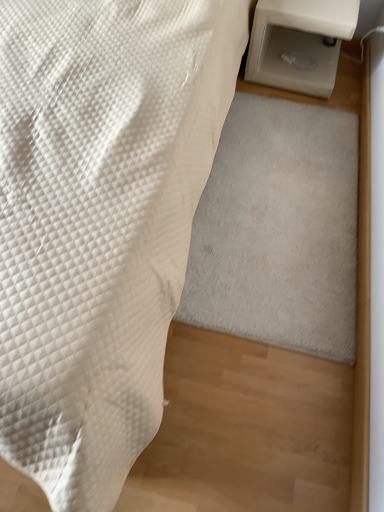
Question: From the image's perspective, would you say white plastic table at right is shown under white quilted fabric at lower left?

Choices:
 (A) yes
 (B) no

Answer: (B)

Question: Is there a large distance between white plastic table at right and white quilted fabric at lower left?

Choices:
 (A) yes
 (B) no

Answer: (B)

Question: Is white quilted fabric at lower left a part of white plastic table at right?

Choices:
 (A) no
 (B) yes

Answer: (A)

Question: Can you confirm if white plastic table at right is wider than white quilted fabric at lower left?

Choices:
 (A) yes
 (B) no

Answer: (B)

Question: Is white plastic table at right positioned with its back to white quilted fabric at lower left?

Choices:
 (A) no
 (B) yes

Answer: (A)

Question: In terms of size, does white soft rug at lower right appear bigger or smaller than white quilted fabric at lower left?

Choices:
 (A) big
 (B) small

Answer: (B)

Question: Considering the positions of point (216, 295) and point (8, 305), is point (216, 295) closer or farther from the camera than point (8, 305)?

Choices:
 (A) closer
 (B) farther

Answer: (B)

Question: Is white soft rug at lower right to the left or to the right of white quilted fabric at lower left in the image?

Choices:
 (A) left
 (B) right

Answer: (B)

Question: Is white soft rug at lower right wider or thinner than white quilted fabric at lower left?

Choices:
 (A) wide
 (B) thin

Answer: (B)

Question: From a real-world perspective, is white plastic table at right physically located above or below white soft rug at lower right?

Choices:
 (A) above
 (B) below

Answer: (A)

Question: From the image's perspective, is white plastic table at right located above or below white soft rug at lower right?

Choices:
 (A) below
 (B) above

Answer: (B)

Question: Does point (306, 38) appear closer or farther from the camera than point (331, 228)?

Choices:
 (A) closer
 (B) farther

Answer: (B)

Question: Based on their positions, is white plastic table at right located to the left or right of white soft rug at lower right?

Choices:
 (A) right
 (B) left

Answer: (A)

Question: From the image's perspective, is white quilted fabric at lower left above or below white plastic table at right?

Choices:
 (A) above
 (B) below

Answer: (B)

Question: Relative to white plastic table at right, is white quilted fabric at lower left in front or behind?

Choices:
 (A) front
 (B) behind

Answer: (A)